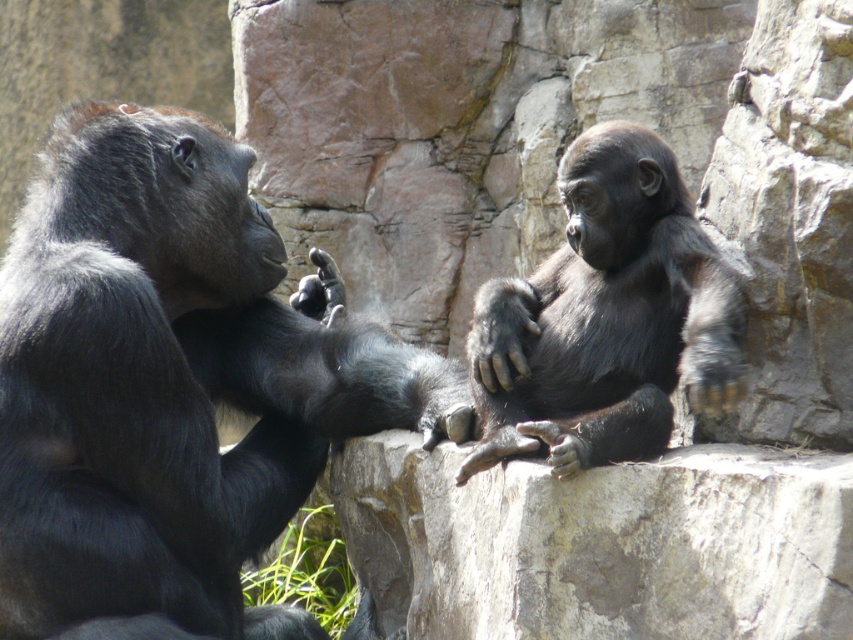
You are a zookeeper standing at the center of the enclosure. You need to approach the shiny black gorilla at left to provide food. Based on its current position, which direction should you move relative to your current position?

The shiny black gorilla at left is located at point 0.602 on the x axis and 0.202 on the y axis. Since you are at the center of the enclosure, which is typically at coordinates (x=426, y=320), you should move northeast to reach the shiny black gorilla at left.

You are a zookeeper observing the two shiny black gorillas in the enclosure. You need to determine if the shiny black gorilla at left has a wider stance than the shiny black gorilla at center. Based on the image, what can you conclude?

The shiny black gorilla at left is wider than the shiny black gorilla at center, so it has a wider stance.

You are a zookeeper who needs to provide food to both gorillas. Since the shiny black gorilla at left is larger than the shiny black gorilla at center, which one should receive a bigger portion of food?

The shiny black gorilla at left should receive a bigger portion of food because it is larger in size compared to the shiny black gorilla at center.